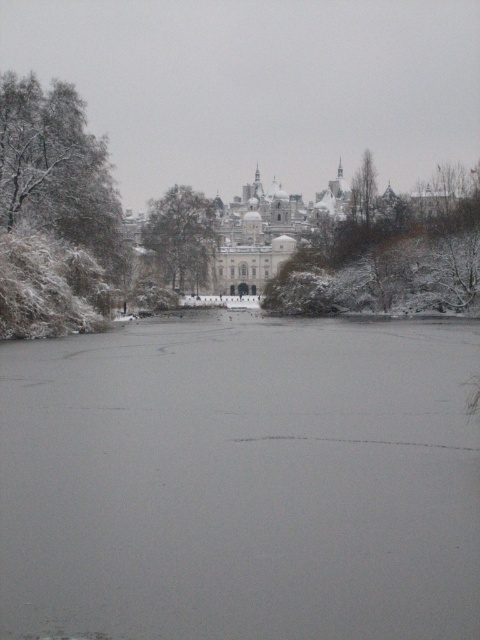
You are standing at the point closest to the viewer in the winter scene. Which point, point [447,266] or point [159,225], is closer to you?

Point [447,266] is in front of point [159,225], so it is closer to you.

You are standing at the point marked as point (54, 212) in the image. Looking around, you see a white snow covered tree at left and the grand building in the background. Which object is closer to your current position?

The white snow covered tree at left is located at point (54, 212), so it is exactly at your current position. The grand building in the background is further away from your position.